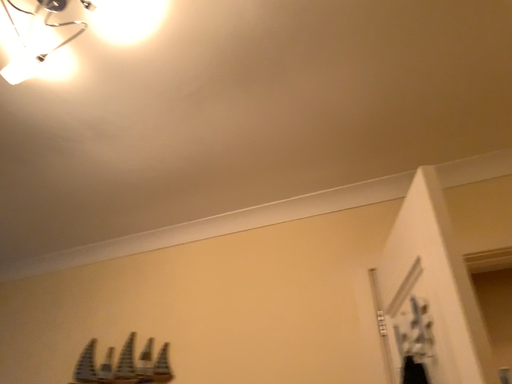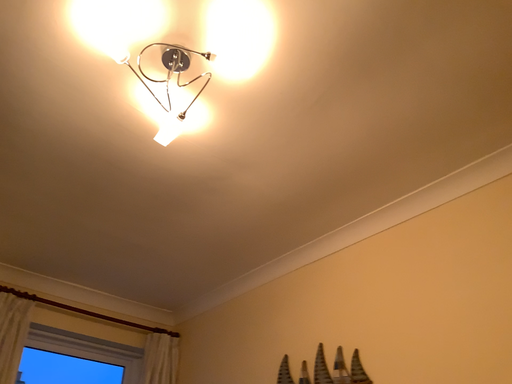
Question: How did the camera likely rotate when shooting the video?

Choices:
 (A) rotated right
 (B) rotated left

Answer: (B)